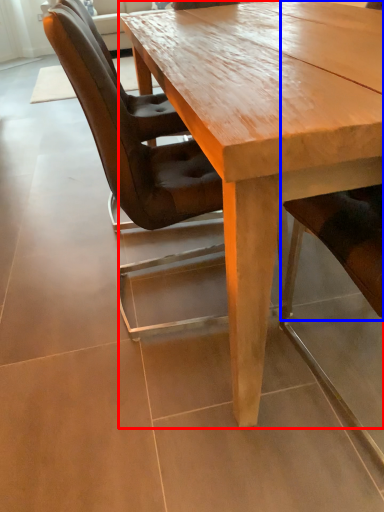
Question: Which point is closer to the camera, coffee table (highlighted by a red box) or chair (highlighted by a blue box)?

Choices:
 (A) coffee table
 (B) chair

Answer: (B)